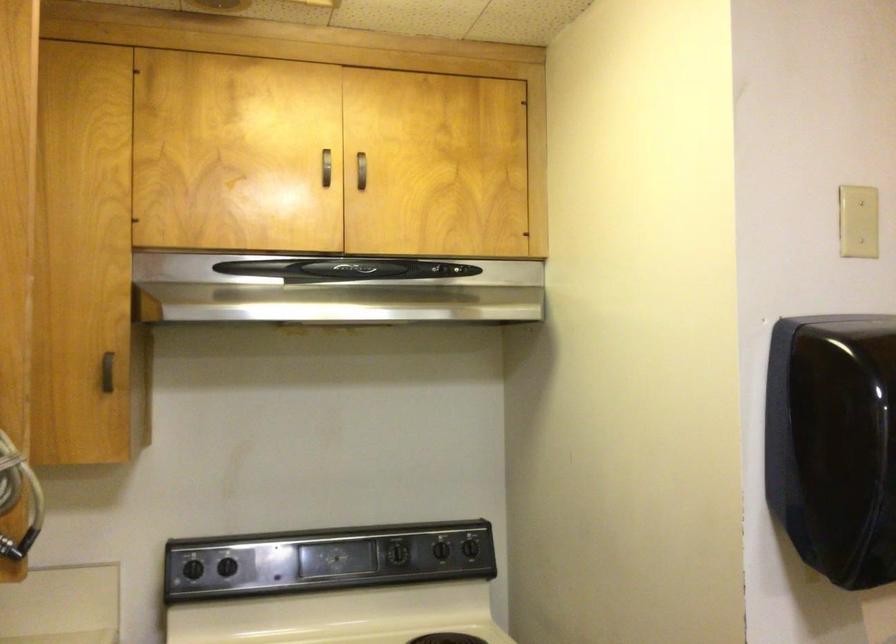
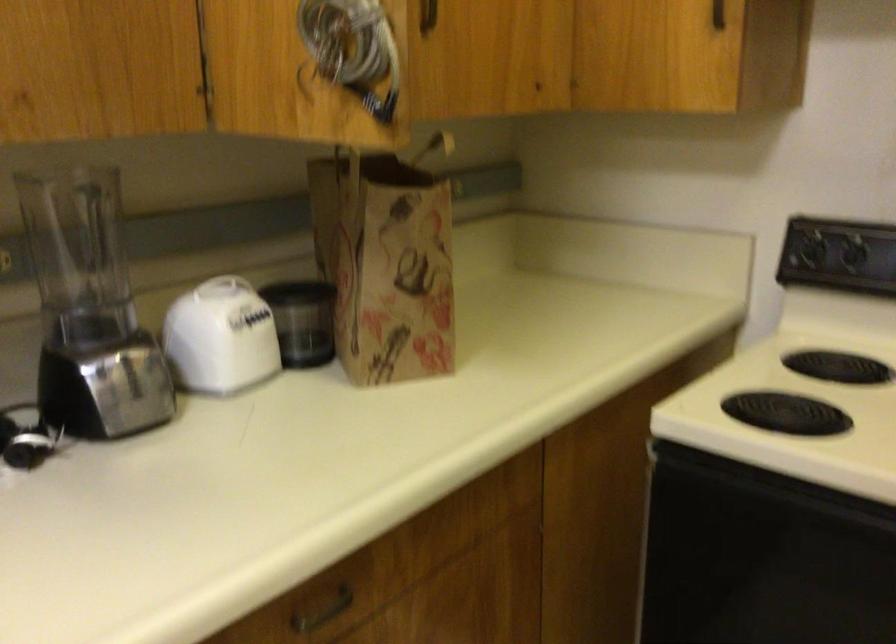
Based on the continuous images, in which direction is the camera rotating?

The camera's rotation is toward left-down.